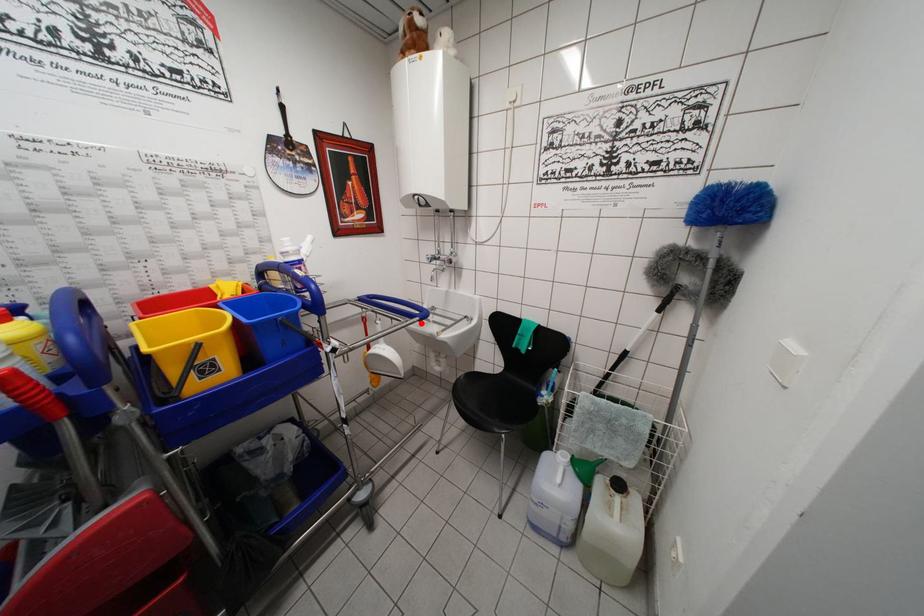
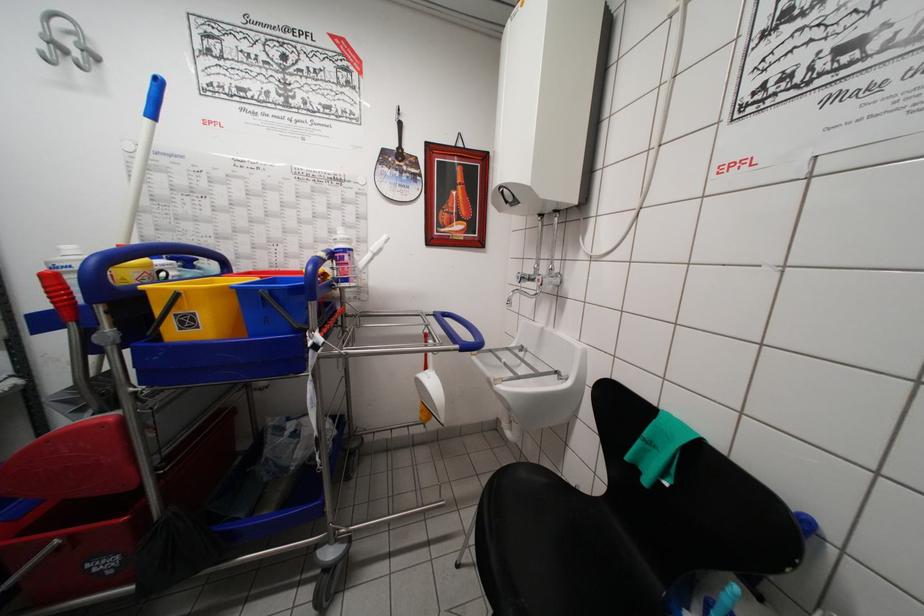
Find the pixel in the second image that matches the highlighted location in the first image.

(460, 351)